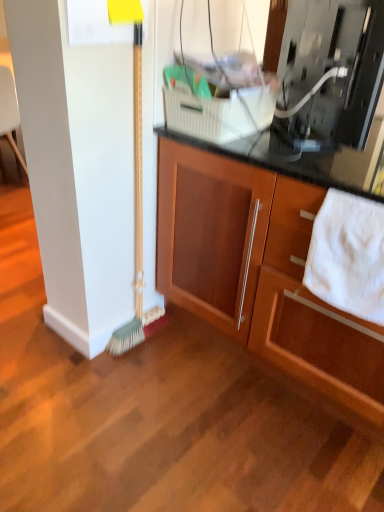
Identify the location of wooden cabinet at center. The image size is (384, 512). (262, 270).

At what (x,y) coordinates should I click in order to perform the action: click on wooden cabinet at center. Please return your answer as a coordinate pair (x, y). Looking at the image, I should click on (262, 270).

Does wooden cabinet at center come behind green bristle broom at left?

No, wooden cabinet at center is in front of green bristle broom at left.

Is wooden cabinet at center positioned with its back to green bristle broom at left?

That's not correct — wooden cabinet at center is not looking away from green bristle broom at left.

Is green bristle broom at left surrounded by wooden cabinet at center?

Definitely not — green bristle broom at left is not inside wooden cabinet at center.

Which object is closer to the camera taking this photo, wooden cabinet at center or metallic silver microwave at upper right?

wooden cabinet at center is in front.

From a real-world perspective, which object stands above the other?

metallic silver microwave at upper right is physically above.

From the image's perspective, between wooden cabinet at center and metallic silver microwave at upper right, which one is located above?

From the image's view, metallic silver microwave at upper right is above.

Is wooden cabinet at center looking in the opposite direction of metallic silver microwave at upper right?

No, wooden cabinet at center's orientation is not away from metallic silver microwave at upper right.

From the image's perspective, is wooden cabinet at center above or below white soft towel at lower right?

wooden cabinet at center is above white soft towel at lower right.

In terms of width, does wooden cabinet at center look wider or thinner when compared to white soft towel at lower right?

wooden cabinet at center is wider than white soft towel at lower right.

Is wooden cabinet at center next to white soft towel at lower right?

wooden cabinet at center and white soft towel at lower right are not in contact.

Is green bristle broom at left a part of white soft towel at lower right?

No, green bristle broom at left is not a part of white soft towel at lower right.

Who is more distant, white soft towel at lower right or green bristle broom at left?

green bristle broom at left is more distant.

From the image's perspective, relative to green bristle broom at left, is white soft towel at lower right above or below?

Based on their image positions, white soft towel at lower right is located beneath green bristle broom at left.

Is white soft towel at lower right with green bristle broom at left?

white soft towel at lower right and green bristle broom at left are not in contact.

Is green bristle broom at left not within metallic silver microwave at upper right?

That's correct, green bristle broom at left is outside of metallic silver microwave at upper right.

How different are the orientations of green bristle broom at left and metallic silver microwave at upper right in degrees?

There is a 48.3-degree angle between the facing directions of green bristle broom at left and metallic silver microwave at upper right.

Who is taller, green bristle broom at left or metallic silver microwave at upper right?

green bristle broom at left is taller.

Is green bristle broom at left far from metallic silver microwave at upper right?

No, there isn't a large distance between green bristle broom at left and metallic silver microwave at upper right.

Based on the photo, is green bristle broom at left taller or shorter than white soft towel at lower right?

green bristle broom at left is taller than white soft towel at lower right.

From the image's perspective, is green bristle broom at left above white soft towel at lower right?

Yes, from the image's perspective, green bristle broom at left is above white soft towel at lower right.

Is green bristle broom at left to the left of white soft towel at lower right from the viewer's perspective?

Correct, you'll find green bristle broom at left to the left of white soft towel at lower right.

Is green bristle broom at left oriented towards white soft towel at lower right?

Yes.

The width and height of the screenshot is (384, 512). In order to click on cabinetry below the green bristle broom at left (from the image's perspective) in this screenshot , I will do [262, 270].

From a real-world perspective, is green bristle broom at left above or below wooden cabinet at center?

In terms of real-world spatial position, green bristle broom at left is above wooden cabinet at center.

From the image's perspective, is green bristle broom at left located beneath wooden cabinet at center?

Incorrect, from the image's perspective, green bristle broom at left is higher than wooden cabinet at center.

Where is `brush above the wooden cabinet at center (from the image's perspective)`? The image size is (384, 512). brush above the wooden cabinet at center (from the image's perspective) is located at coordinates [x=134, y=182].

Locate an element on the screen. Image resolution: width=384 pixels, height=512 pixels. cabinetry in front of the metallic silver microwave at upper right is located at coordinates (262, 270).

Considering their positions, is wooden cabinet at center positioned closer to green bristle broom at left than metallic silver microwave at upper right?

wooden cabinet at center is positioned closer to the anchor green bristle broom at left.

Based on their spatial positions, is green bristle broom at left or white soft towel at lower right further from wooden cabinet at center?

green bristle broom at left is positioned further to the anchor wooden cabinet at center.

When comparing their distances from green bristle broom at left, does metallic silver microwave at upper right or wooden cabinet at center seem closer?

wooden cabinet at center is closer to green bristle broom at left.

From the image, which object appears to be nearer to metallic silver microwave at upper right, wooden cabinet at center or green bristle broom at left?

Among the two, wooden cabinet at center is located nearer to metallic silver microwave at upper right.

Estimate the real-world distances between objects in this image. Which object is further from wooden cabinet at center, green bristle broom at left or metallic silver microwave at upper right?

Based on the image, metallic silver microwave at upper right appears to be further to wooden cabinet at center.

Estimate the real-world distances between objects in this image. Which object is closer to white soft towel at lower right, metallic silver microwave at upper right or green bristle broom at left?

metallic silver microwave at upper right.

Considering their positions, is green bristle broom at left positioned closer to white soft towel at lower right than wooden cabinet at center?

The object closer to white soft towel at lower right is wooden cabinet at center.

When comparing their distances from green bristle broom at left, does wooden cabinet at center or white soft towel at lower right seem closer?

wooden cabinet at center lies closer to green bristle broom at left than the other object.

The image size is (384, 512). In order to click on cabinetry between metallic silver microwave at upper right and white soft towel at lower right in the up-down direction in this screenshot , I will do `click(262, 270)`.

Where is `appliance located between green bristle broom at left and white soft towel at lower right in the left-right direction`? appliance located between green bristle broom at left and white soft towel at lower right in the left-right direction is located at coordinates [330, 70].

Identify the location of bath towel between green bristle broom at left and wooden cabinet at center from left to right. The height and width of the screenshot is (512, 384). (x=348, y=256).

Where is `appliance between green bristle broom at left and wooden cabinet at center from left to right`? This screenshot has height=512, width=384. appliance between green bristle broom at left and wooden cabinet at center from left to right is located at coordinates (330, 70).